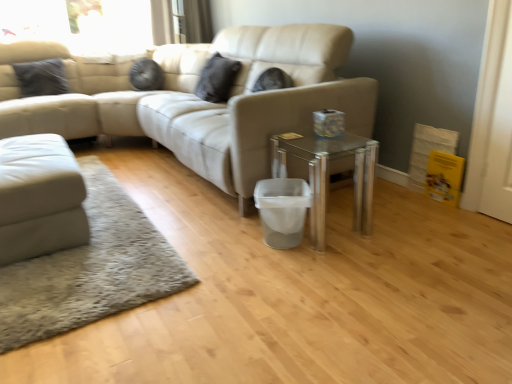
The height and width of the screenshot is (384, 512). I want to click on vacant space situated on the left part of white wood screen door at right, so click(471, 217).